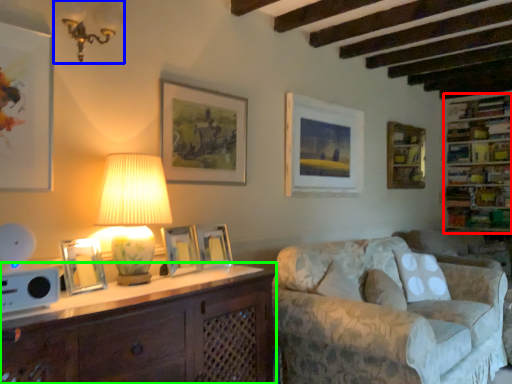
Question: Which object is the farthest from shelf (highlighted by a red box)? Choose among these: lamp (highlighted by a blue box) or cabinetry (highlighted by a green box).

Choices:
 (A) lamp
 (B) cabinetry

Answer: (A)